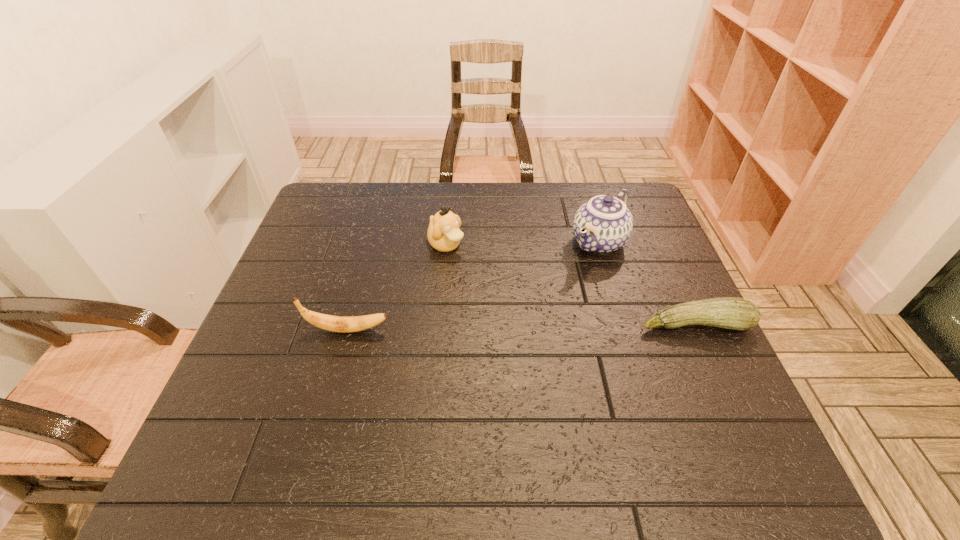
You are a GUI agent. You are given a task and a screenshot of the screen. Output one action in this format:
    pyautogui.click(x=<x>, y=<y>)
    Task: Click on the vacant region located 0.290m on the face of the second tallest object
    
    Given the screenshot: What is the action you would take?
    pyautogui.click(x=533, y=316)

You are a GUI agent. You are given a task and a screenshot of the screen. Output one action in this format:
    pyautogui.click(x=<x>, y=<y>)
    Task: Click on the vacant space located 0.080m from the spout of the chinaware
    The image size is (960, 540).
    Given the screenshot: What is the action you would take?
    pyautogui.click(x=565, y=276)

Find the location of a particular element. The width and height of the screenshot is (960, 540). vacant region located from the spout of the chinaware is located at coordinates (545, 294).

This screenshot has height=540, width=960. What are the coordinates of `vacant space located from the spout of the chinaware` in the screenshot? It's located at (496, 340).

Image resolution: width=960 pixels, height=540 pixels. Identify the location of object that is positioned at the far edge. (604, 224).

Find the location of a particular element. object that is at the left edge is located at coordinates (332, 323).

This screenshot has height=540, width=960. In order to click on zucchini located at the right edge in this screenshot , I will do `click(734, 313)`.

The image size is (960, 540). I want to click on chinaware that is positioned at the right edge, so coord(604,224).

This screenshot has height=540, width=960. What are the coordinates of `object situated at the far right corner` in the screenshot? It's located at (604, 224).

In the image, there is a desktop. Where is `free space at the far edge`? This screenshot has height=540, width=960. free space at the far edge is located at coordinates (504, 206).